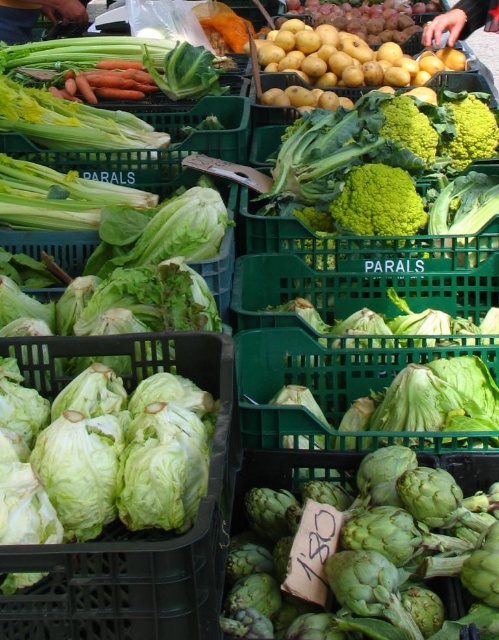
Does green textured broccoli at upper right come in front of dark brown leather handbag at upper left?

Yes, green textured broccoli at upper right is in front of dark brown leather handbag at upper left.

Between point (445, 138) and point (1, 12), which one is positioned behind?

Positioned behind is point (1, 12).

Which is in front, point (497, 131) or point (11, 44)?

Point (497, 131)

This screenshot has height=640, width=499. What are the coordinates of `green textured broccoli at upper right` in the screenshot? It's located at (468, 129).

Does green textured broccoli at center have a greater height compared to green textured broccoli at upper right?

No, green textured broccoli at center is not taller than green textured broccoli at upper right.

How distant is green textured broccoli at center from green textured broccoli at upper right?

20.93 inches

Is point (410, 204) closer to viewer compared to point (461, 148)?

That is True.

The width and height of the screenshot is (499, 640). I want to click on green textured broccoli at center, so click(x=378, y=204).

Between point (282, 477) and point (371, 198), which one is positioned behind?

Point (371, 198)

Who is more forward, (317, 525) or (340, 196)?

Point (317, 525) is more forward.

The image size is (499, 640). What are the coordinates of `green rough artichoke at center` in the screenshot? It's located at (282, 472).